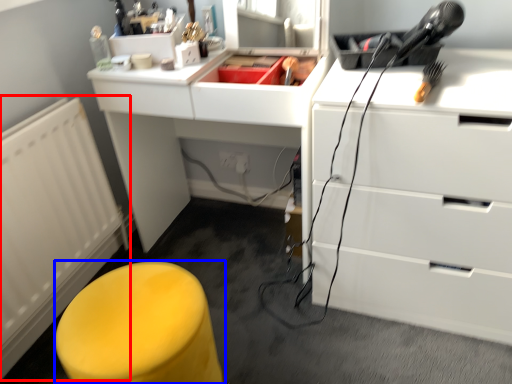
Question: Which object is closer to the camera taking this photo, radiator (highlighted by a red box) or furniture (highlighted by a blue box)?

Choices:
 (A) radiator
 (B) furniture

Answer: (B)